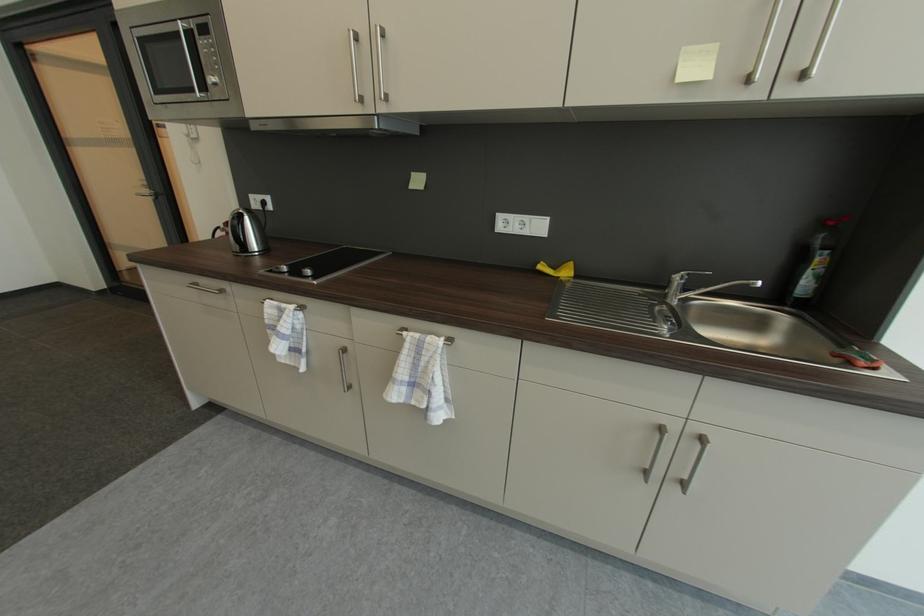
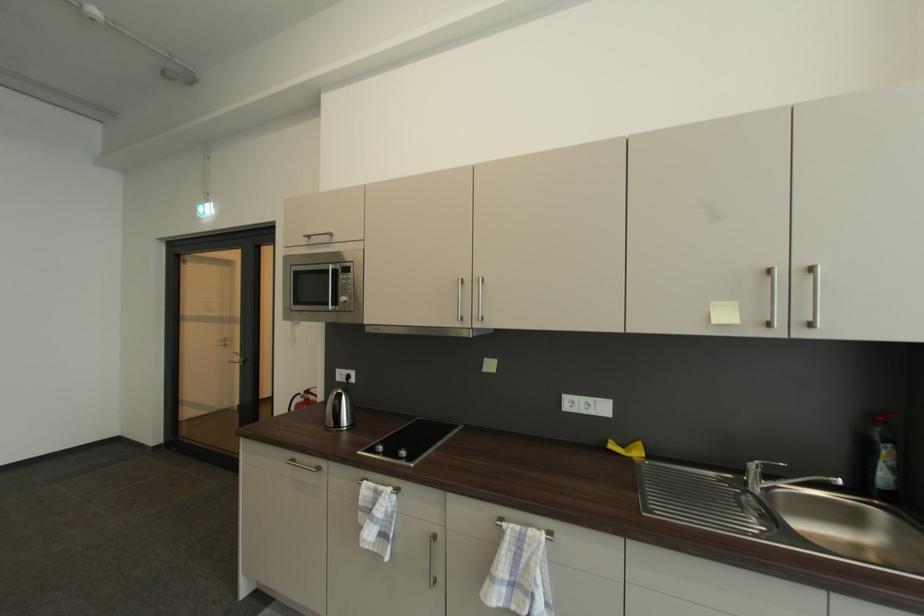
The images are taken continuously from a first-person perspective. In which direction are you moving?

The movement direction of the cameraman is left, backward.